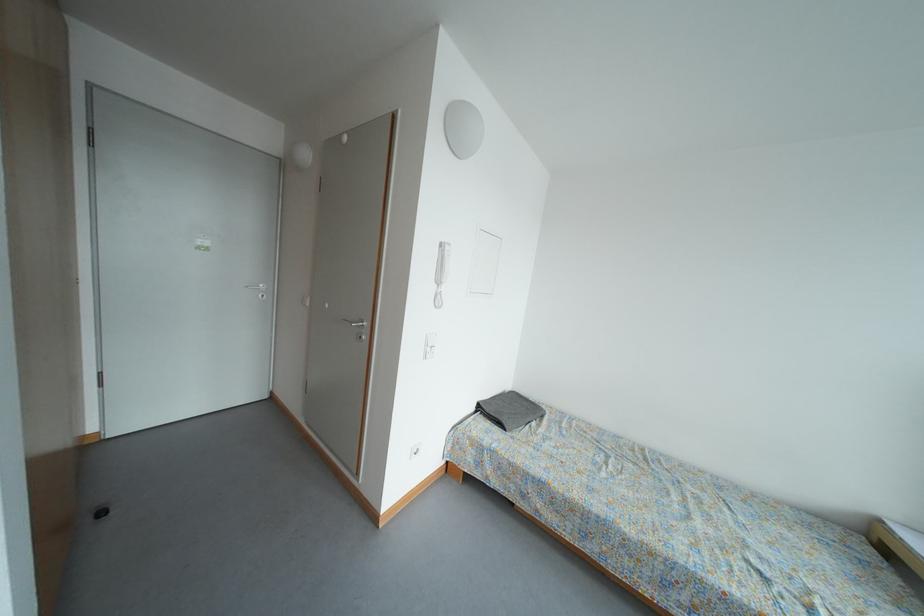
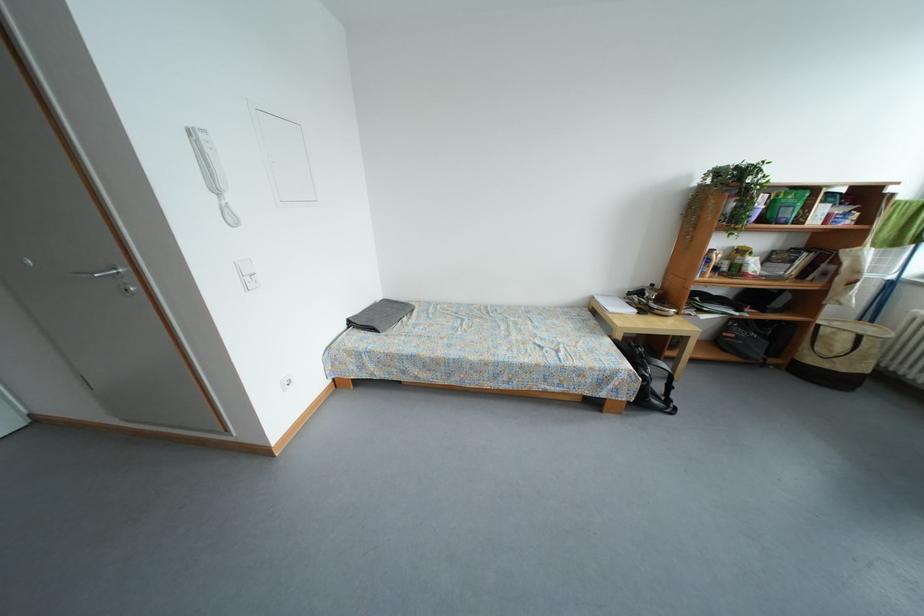
How did the camera likely rotate?

The rotation direction of the camera is right-down.